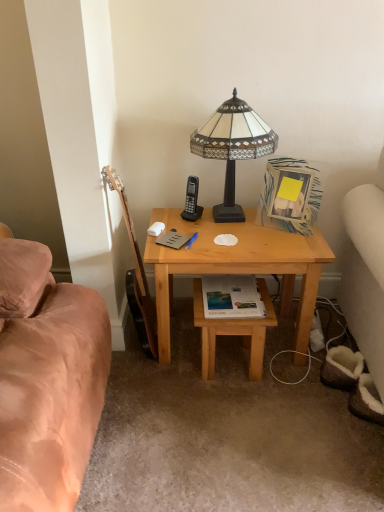
Where is `unoccupied region to the right of brown wood guitar at left`? The width and height of the screenshot is (384, 512). unoccupied region to the right of brown wood guitar at left is located at coordinates (183, 355).